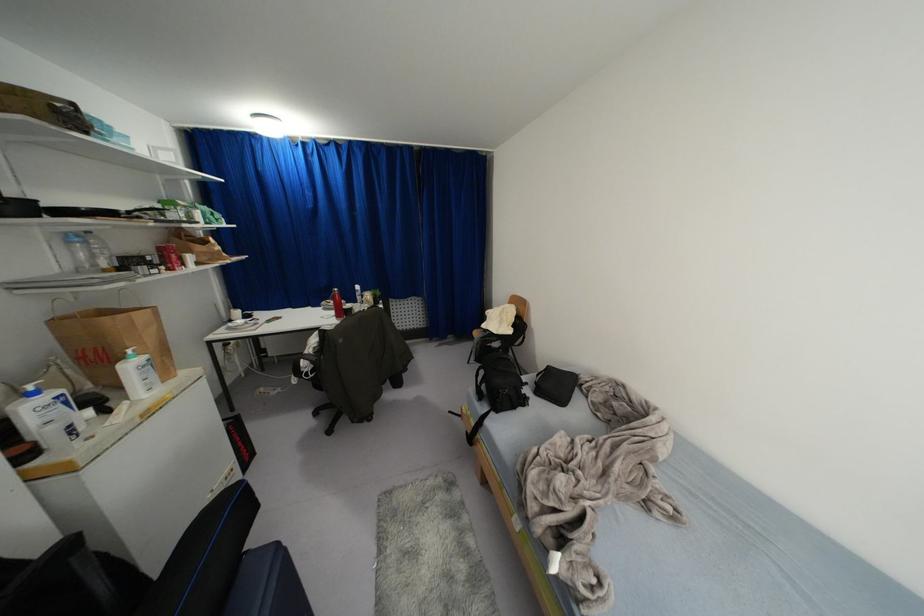
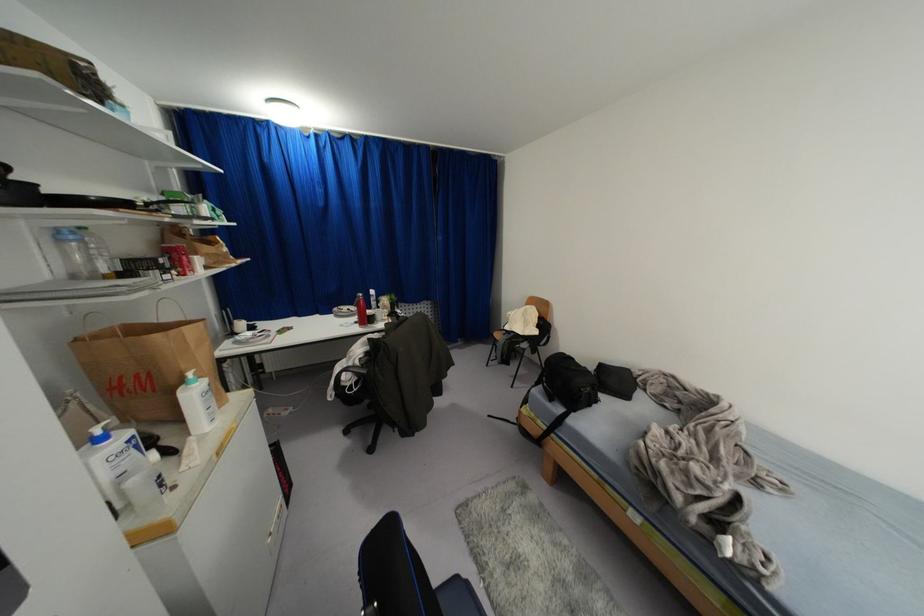
Locate, in the second image, the point that corresponds to (128,351) in the first image.

(189, 374)